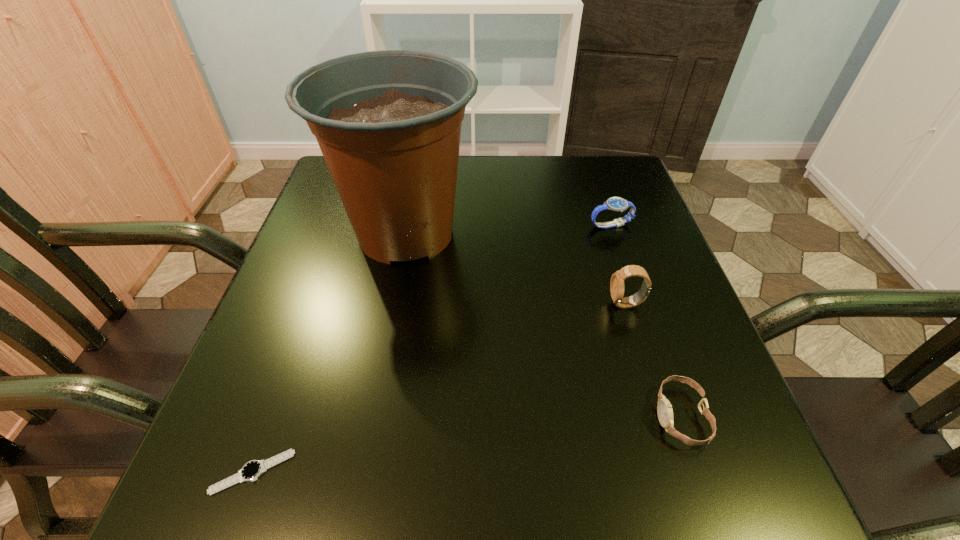
Image resolution: width=960 pixels, height=540 pixels. I want to click on vacant area that lies between the tallest object and the second shortest watch, so click(x=543, y=325).

The height and width of the screenshot is (540, 960). Identify the location of free point between the farthest watch and the tallest object. (509, 229).

I want to click on free space between the tallest object and the shortest object, so click(x=329, y=352).

You are a GUI agent. You are given a task and a screenshot of the screen. Output one action in this format:
    pyautogui.click(x=<x>, y=<y>)
    Task: Click on the free area in between the flowerpot and the second farthest watch
    This screenshot has width=960, height=540.
    Given the screenshot: What is the action you would take?
    tap(516, 268)

Where is `empty space between the shortest watch and the second shortest watch`? The width and height of the screenshot is (960, 540). empty space between the shortest watch and the second shortest watch is located at coordinates (467, 444).

This screenshot has width=960, height=540. Find the location of `empty space between the leftmost watch and the tallest object`. empty space between the leftmost watch and the tallest object is located at coordinates click(329, 352).

At what (x,y) coordinates should I click in order to perform the action: click on vacant space in between the tallest watch and the leftmost watch. Please return your answer as a coordinate pair (x, y). This screenshot has height=540, width=960. Looking at the image, I should click on (440, 388).

In order to click on vacant space that is in between the flowerpot and the second tallest watch in this screenshot , I will do `click(509, 229)`.

You are a GUI agent. You are given a task and a screenshot of the screen. Output one action in this format:
    pyautogui.click(x=<x>, y=<y>)
    Task: Click on the empty space between the shortest watch and the third tallest object
    This screenshot has height=540, width=960.
    Given the screenshot: What is the action you would take?
    pyautogui.click(x=432, y=349)

Identify the location of empty location between the second shortest object and the shortest object. [x=467, y=444].